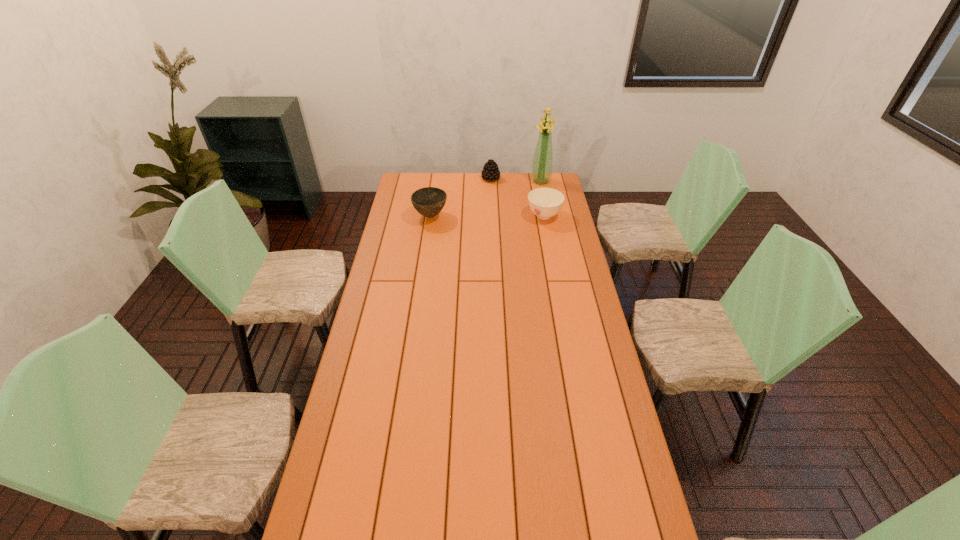
Where is `blank space located 0.250m at the narrow end of the pinecone`? Image resolution: width=960 pixels, height=540 pixels. blank space located 0.250m at the narrow end of the pinecone is located at coordinates (478, 207).

Where is `free space located 0.320m at the narrow end of the pinecone`? free space located 0.320m at the narrow end of the pinecone is located at coordinates (475, 214).

The height and width of the screenshot is (540, 960). What are the coordinates of `bouquet that is at the far edge` in the screenshot? It's located at (541, 172).

Find the location of a particular element. Image resolution: width=960 pixels, height=540 pixels. pinecone that is positioned at the far edge is located at coordinates (490, 171).

Where is `object that is positioned at the left edge`? object that is positioned at the left edge is located at coordinates (429, 201).

Where is `sugar bowl that is at the right edge`? Image resolution: width=960 pixels, height=540 pixels. sugar bowl that is at the right edge is located at coordinates (545, 203).

What are the coordinates of `bouquet that is at the right edge` in the screenshot? It's located at (541, 172).

Locate an element on the screen. object that is positioned at the far right corner is located at coordinates (541, 172).

The width and height of the screenshot is (960, 540). Identify the location of vacant space at the far edge. (516, 193).

At what (x,y) coordinates should I click in order to perform the action: click on vacant space at the near edge of the desktop. Please return your answer as a coordinate pair (x, y). The image size is (960, 540). Looking at the image, I should click on (479, 515).